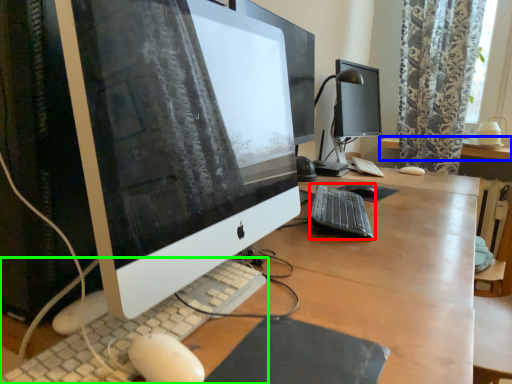
Question: Which object is the closest to the computer keyboard (highlighted by a red box)? Choose among these: desk (highlighted by a blue box) or computer keyboard (highlighted by a green box).

Choices:
 (A) desk
 (B) computer keyboard

Answer: (B)